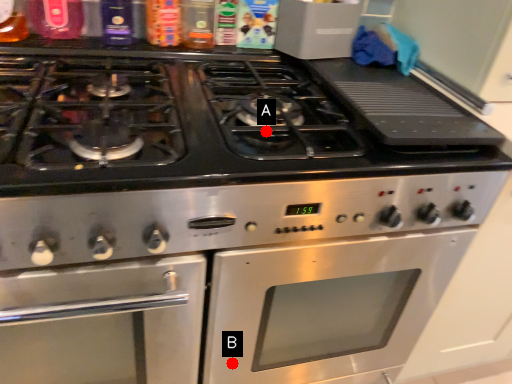
Question: Two points are circled on the image, labeled by A and B beside each circle. Among these points, which one is nearest to the camera?

Choices:
 (A) A is closer
 (B) B is closer

Answer: (A)